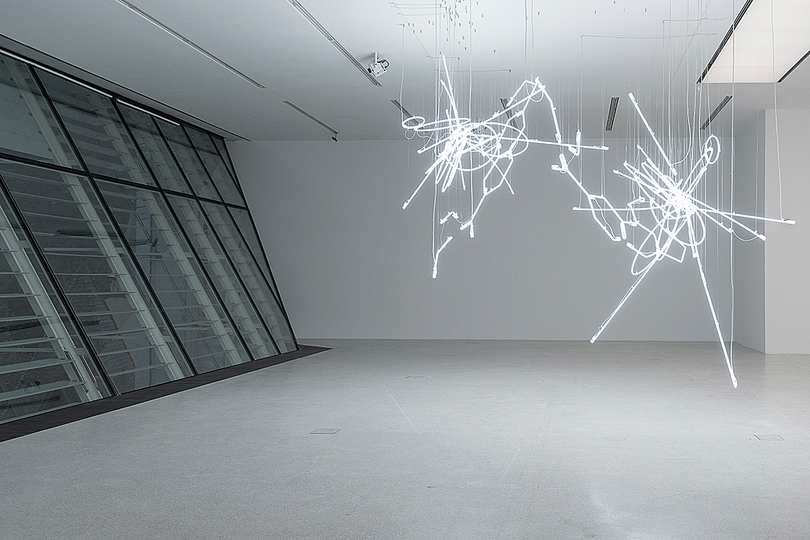
Locate an element on the screen. The image size is (810, 540). white floor is located at coordinates (499, 402).